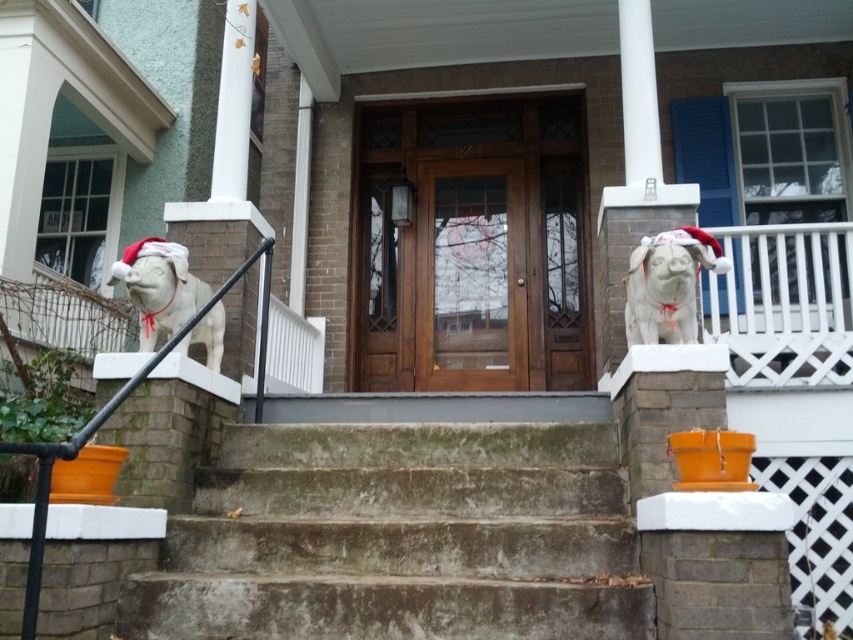
Question: Does wooden door at center appear under white stone dog at center?

Choices:
 (A) yes
 (B) no

Answer: (B)

Question: Which object is closer to the camera taking this photo?

Choices:
 (A) white stone dog at left
 (B) white stone dog at center
 (C) wooden door at center

Answer: (B)

Question: Can you confirm if concrete steps at center is smaller than white stone dog at left?

Choices:
 (A) yes
 (B) no

Answer: (B)

Question: Among these objects, which one is nearest to the camera?

Choices:
 (A) concrete steps at center
 (B) white stone dog at left
 (C) wooden door at center

Answer: (A)

Question: Estimate the real-world distances between objects in this image. Which object is closer to the white stone dog at center?

Choices:
 (A) wooden door at center
 (B) white stone dog at left

Answer: (B)

Question: Is the position of concrete steps at center more distant than that of white stone dog at left?

Choices:
 (A) no
 (B) yes

Answer: (A)